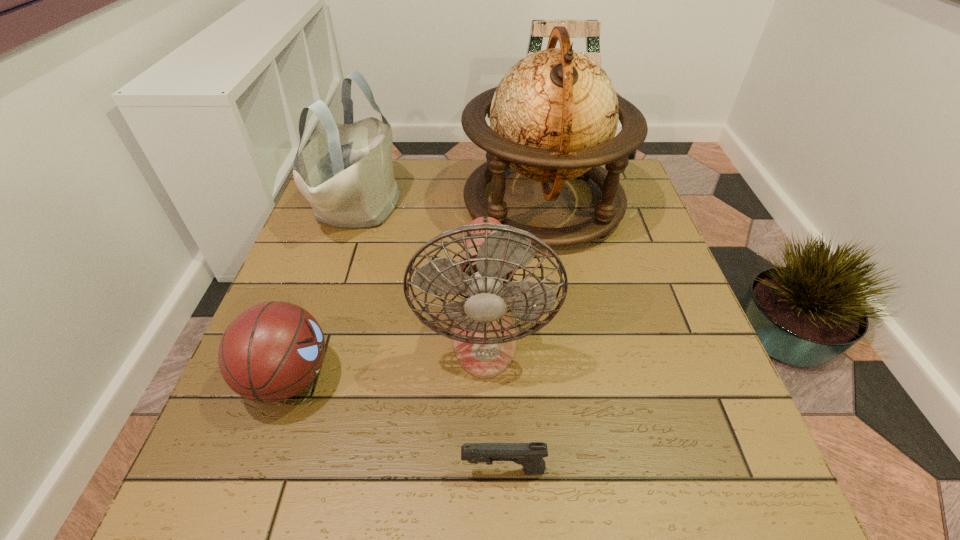
This screenshot has width=960, height=540. What are the coordinates of `globe` in the screenshot? It's located at (553, 117).

Where is `fan`? fan is located at coordinates (484, 339).

In order to click on shopping bag in this screenshot , I will do click(346, 172).

The height and width of the screenshot is (540, 960). I want to click on basketball, so click(272, 351).

What are the coordinates of `pistol` in the screenshot? It's located at (530, 455).

Where is `the shortest object`? The image size is (960, 540). the shortest object is located at coordinates (530, 455).

This screenshot has height=540, width=960. In order to click on free spot located 0.080m on the front of the globe in this screenshot , I will do [556, 280].

Find the location of a particular element. blank area located 0.100m in front of the fan to direct airflow is located at coordinates (485, 434).

Where is `vacant space situated 0.270m on the right of the shopping bag`? vacant space situated 0.270m on the right of the shopping bag is located at coordinates (494, 206).

Locate an element on the screen. This screenshot has width=960, height=540. free region located 0.140m on the front of the basketball is located at coordinates (x=243, y=507).